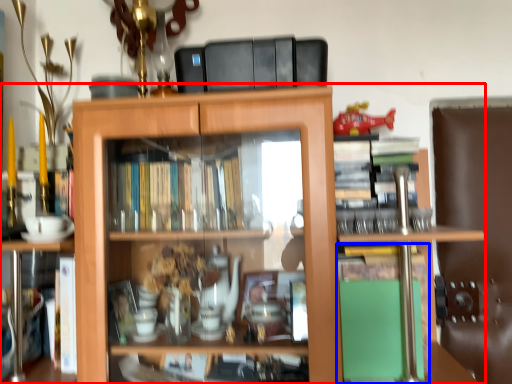
Question: Which of the following is the closest to the observer, shelf (highlighted by a red box) or book (highlighted by a blue box)?

Choices:
 (A) shelf
 (B) book

Answer: (A)